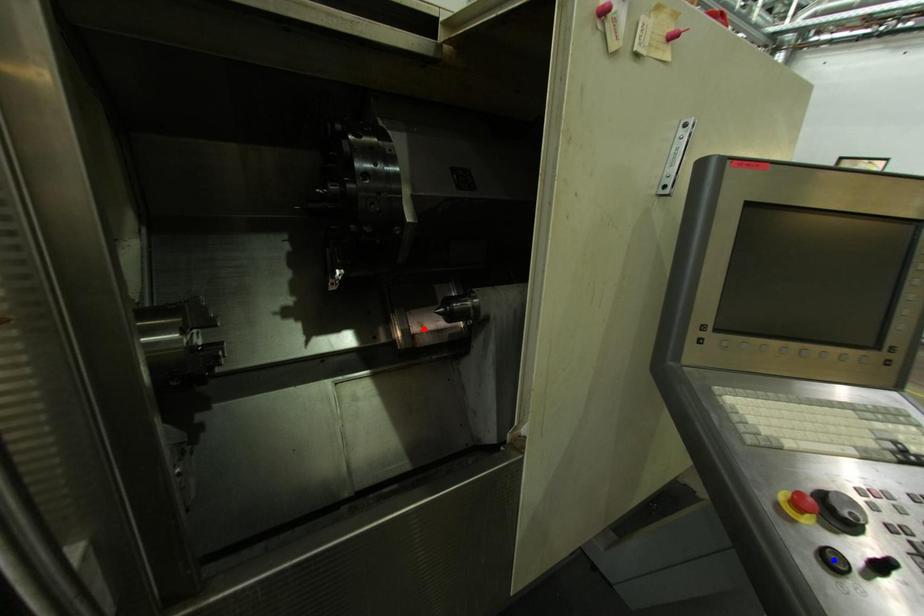
Question: In the image, two points are highlighted. Which point is nearer to the camera? Reply with the corresponding letter.

Choices:
 (A) blue point
 (B) red point

Answer: (A)